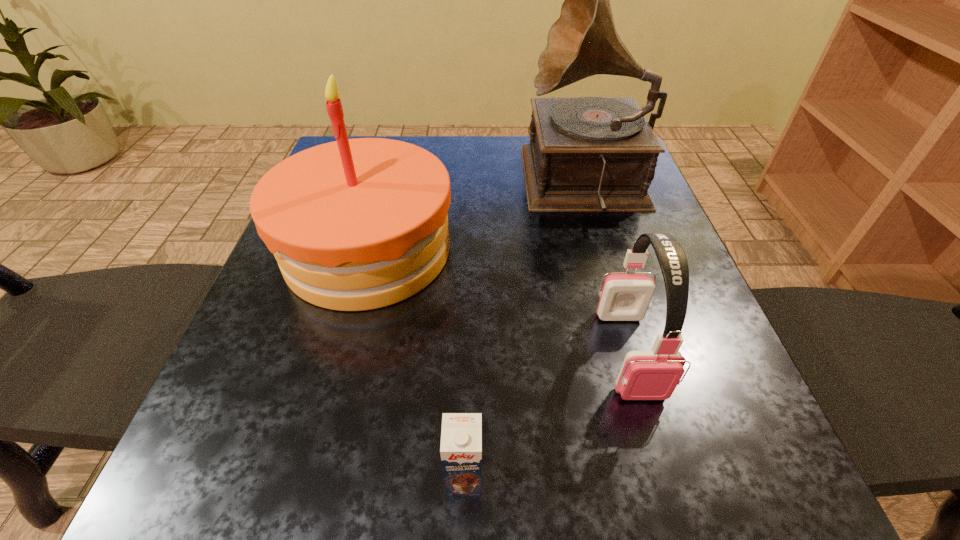
You are a GUI agent. You are given a task and a screenshot of the screen. Output one action in this format:
    pyautogui.click(x=<x>, y=<y>)
    Task: Click on the free region located 0.130m on the outer surface of the second shortest object
    Image resolution: width=960 pixels, height=540 pixels.
    Given the screenshot: What is the action you would take?
    pyautogui.click(x=672, y=500)

At what (x,y) coordinates should I click in order to perform the action: click on object positioned at the far edge. Please return your answer as a coordinate pair (x, y). Looking at the image, I should click on (588, 154).

Find the location of `object that is at the near edge`. object that is at the near edge is located at coordinates (461, 436).

This screenshot has height=540, width=960. I want to click on object that is at the left edge, so click(358, 224).

I want to click on record player present at the right edge, so click(x=588, y=154).

I want to click on earphone at the right edge, so click(x=653, y=374).

The height and width of the screenshot is (540, 960). Identify the location of object that is at the far right corner. (588, 154).

In order to click on free region at the far edge in this screenshot , I will do `click(490, 180)`.

This screenshot has width=960, height=540. Identify the location of vacant space at the near edge of the desktop. (609, 462).

Where is `vacant space at the left edge`? The height and width of the screenshot is (540, 960). vacant space at the left edge is located at coordinates (351, 312).